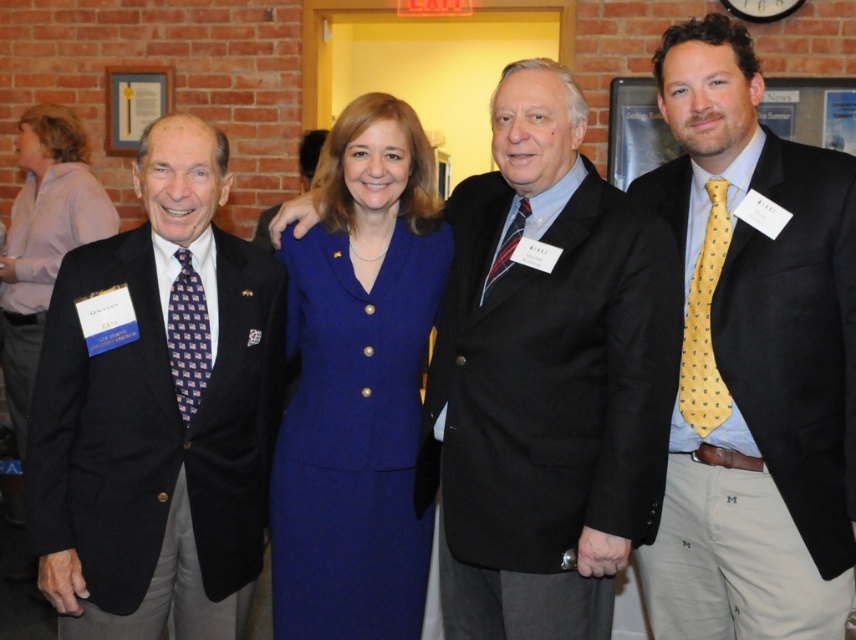
Question: Which point appears closest to the camera in this image?

Choices:
 (A) (321, 461)
 (B) (521, 225)
 (C) (9, 273)

Answer: (B)

Question: Which point is farther to the camera?

Choices:
 (A) yellow dotted tie at right
 (B) blue dotted tie at left
 (C) blue fabric dress at center
 (D) striped silk tie at center

Answer: (C)

Question: Can you confirm if black wool suit at center is positioned below blue fabric dress at center?

Choices:
 (A) no
 (B) yes

Answer: (B)

Question: Is blue woolen suit at center smaller than blue fabric dress at center?

Choices:
 (A) no
 (B) yes

Answer: (B)

Question: Does matte black suit at left come behind striped silk tie at center?

Choices:
 (A) no
 (B) yes

Answer: (A)

Question: Which object is the farthest from the striped silk tie at center?

Choices:
 (A) black wool suit at center
 (B) blue dotted tie at left
 (C) blue woolen suit at center
 (D) matte black suit at right

Answer: (B)